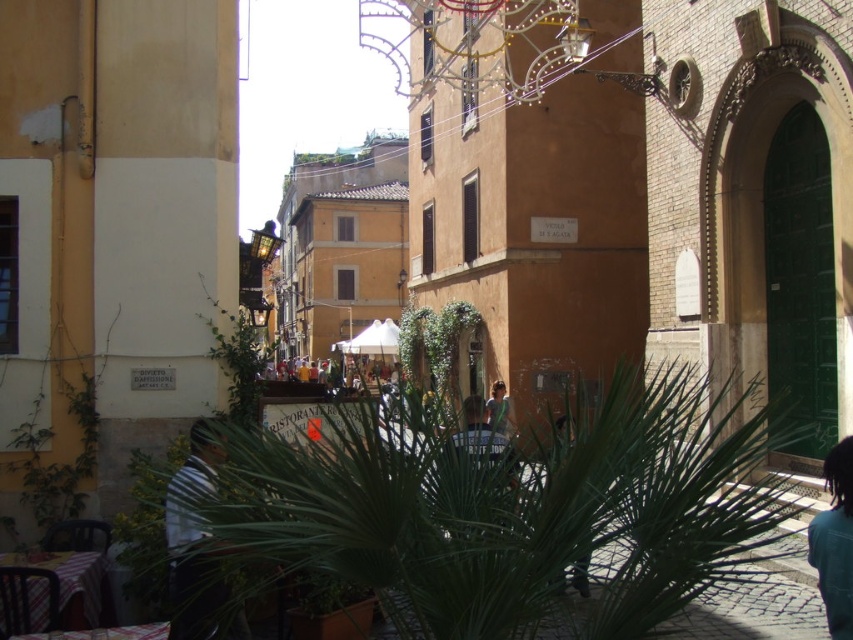
Question: Does green leafy palm tree at center appear over light brown leather jacket at center?

Choices:
 (A) no
 (B) yes

Answer: (B)

Question: Is green leafy palm tree at center bigger than light brown leather jacket at center?

Choices:
 (A) yes
 (B) no

Answer: (B)

Question: Which point is closer to the camera?

Choices:
 (A) (490, 417)
 (B) (578, 429)

Answer: (B)

Question: Can you confirm if green leafy palm tree at center is wider than black hair at lower right?

Choices:
 (A) no
 (B) yes

Answer: (B)

Question: Which of these objects is positioned closest to the green leafy palm tree at center?

Choices:
 (A) black hair at lower right
 (B) light brown leather jacket at center

Answer: (A)

Question: Which point is farther to the camera?

Choices:
 (A) (495, 403)
 (B) (843, 451)

Answer: (A)